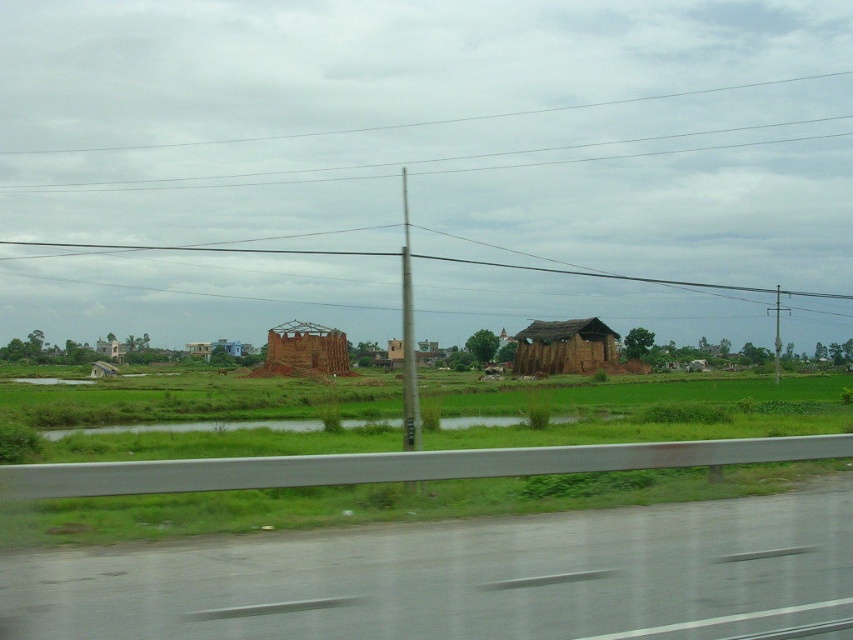
Which is in front, point (61, 556) or point (544, 356)?

Point (61, 556) is in front.

How far apart are gray asphalt highway at lower center and brown wooden hut at center?

94.94 meters

Find the location of a particular element. The image size is (853, 640). gray asphalt highway at lower center is located at coordinates (461, 577).

Which is below, gray asphalt highway at lower center or brown brick hut at center?

brown brick hut at center is lower down.

Is gray asphalt highway at lower center above brown brick hut at center?

Yes, gray asphalt highway at lower center is above brown brick hut at center.

Locate an element on the screen. This screenshot has height=640, width=853. gray asphalt highway at lower center is located at coordinates (461, 577).

Can you confirm if brown wooden hut at center is bigger than brown brick hut at center?

Yes.

Can you confirm if brown wooden hut at center is shorter than brown brick hut at center?

Incorrect, brown wooden hut at center's height does not fall short of brown brick hut at center's.

Between point (537, 358) and point (315, 358), which one is positioned behind?

Positioned behind is point (537, 358).

At what (x,y) coordinates should I click in order to perform the action: click on brown wooden hut at center. Please return your answer as a coordinate pair (x, y). This screenshot has height=640, width=853. Looking at the image, I should click on (564, 348).